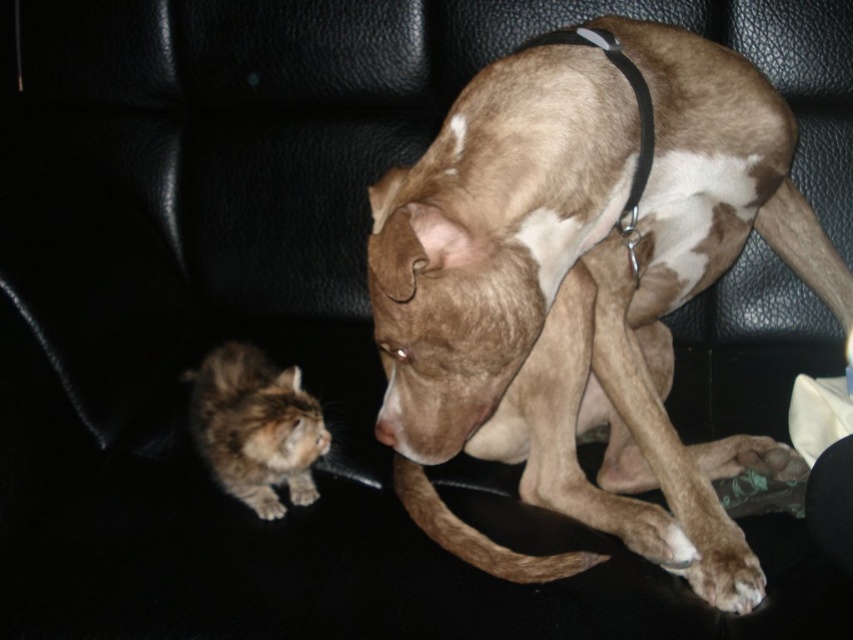
What are the coordinates of the brown speckled fur dog at center?

The brown speckled fur dog at center is located at coordinates point (584, 288).

You are a toy mouse that is 10 inches long. You are placed between the brown speckled fur dog at center and the fluffy brown cat at lower left. Can both the dog and the cat reach you at the same time?

The distance between the brown speckled fur dog at center and the fluffy brown cat at lower left is 14.56 inches. Since the toy mouse is only 10 inches long, it can span the gap between them, allowing both the dog and the cat to reach it simultaneously.